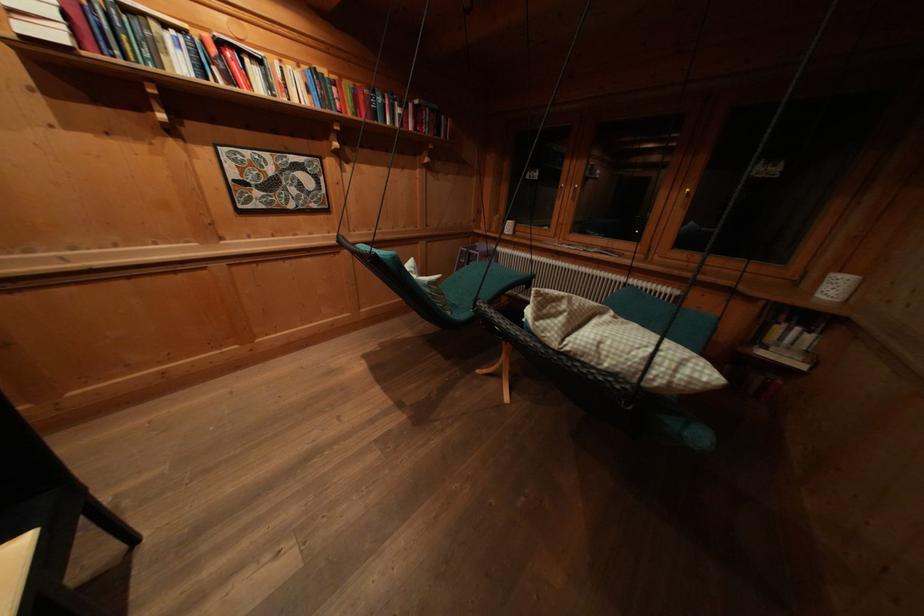
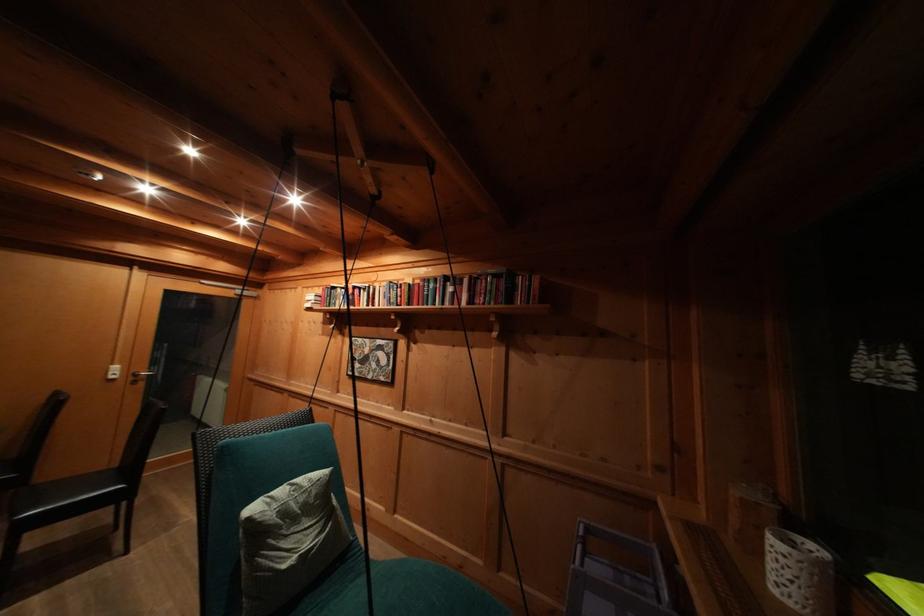
Locate, in the second image, the point that corresponds to pixel 513 238 in the first image.

(780, 594)